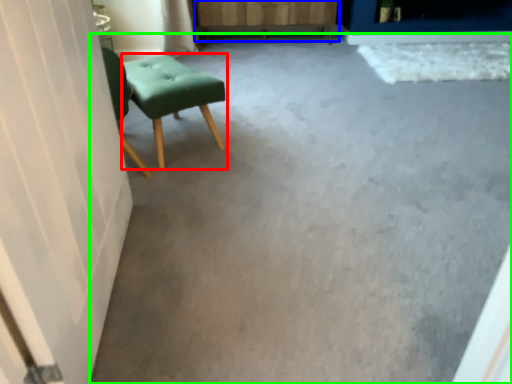
Question: Which object is the closest to the stool (highlighted by a red box)? Choose among these: dresser (highlighted by a blue box) or concrete (highlighted by a green box).

Choices:
 (A) dresser
 (B) concrete

Answer: (B)